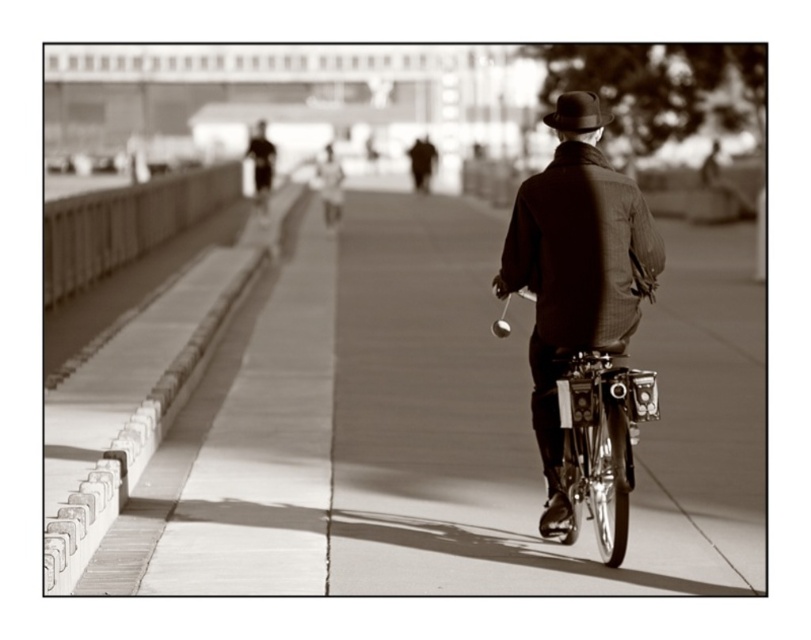
Can you confirm if smooth concrete pavement at center is shorter than dark brown felt hat at upper center?

Yes.

Does smooth concrete pavement at center have a greater width compared to dark brown felt hat at upper center?

Yes, smooth concrete pavement at center is wider than dark brown felt hat at upper center.

Is point (590, 570) farther from camera compared to point (573, 120)?

No, (590, 570) is in front of (573, 120).

The image size is (811, 640). Identify the location of smooth concrete pavement at center. (440, 428).

Does matte brown jacket at center appear under dark brown felt hat at upper center?

Correct, matte brown jacket at center is located below dark brown felt hat at upper center.

Between point (533, 289) and point (567, 131), which one is positioned in front?

Point (567, 131) is more forward.

Locate an element on the screen. matte brown jacket at center is located at coordinates (575, 278).

The image size is (811, 640). Identify the location of smooth concrete pavement at center. (440, 428).

Is smooth concrete pavement at center closer to the viewer compared to matte brown jacket at center?

Yes.

Between point (256, 339) and point (550, 321), which one is positioned behind?

Point (256, 339)

Identify the location of smooth concrete pavement at center. (440, 428).